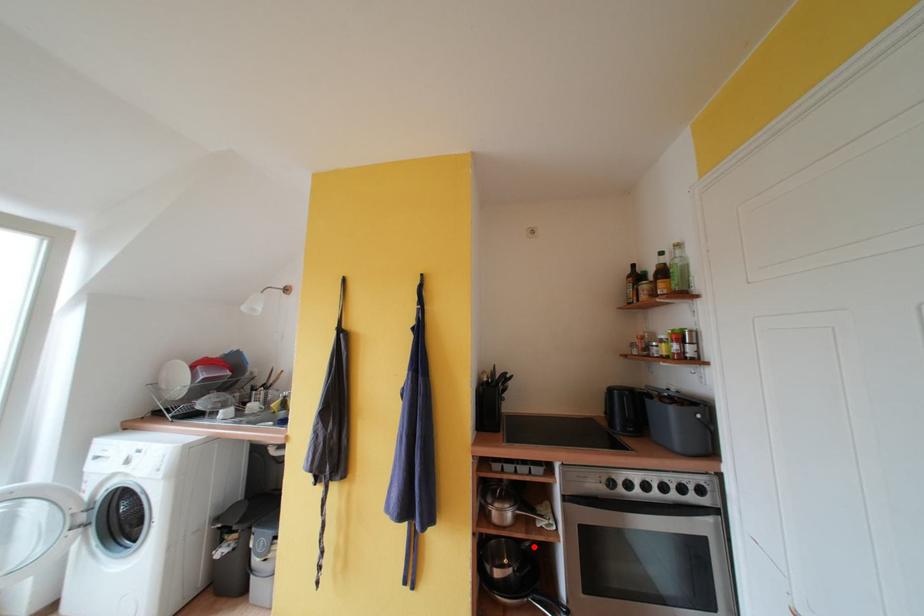
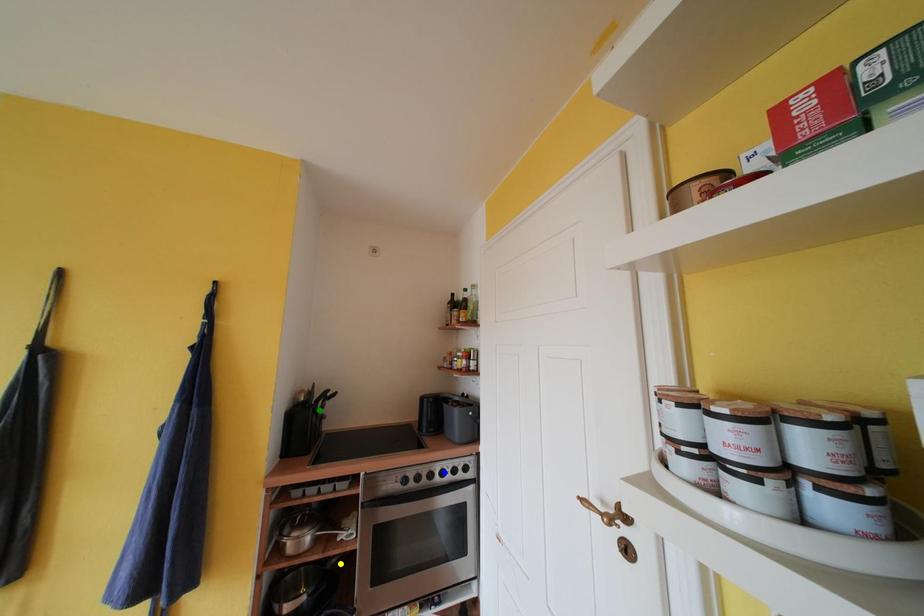
Question: I am providing you with two images of the same scene from different viewpoints. A red point is marked on the first image. You are given multiple points on the second image. Which mark in image 2 goes with the point in image 1?

Choices:
 (A) blue point
 (B) green point
 (C) yellow point

Answer: (C)